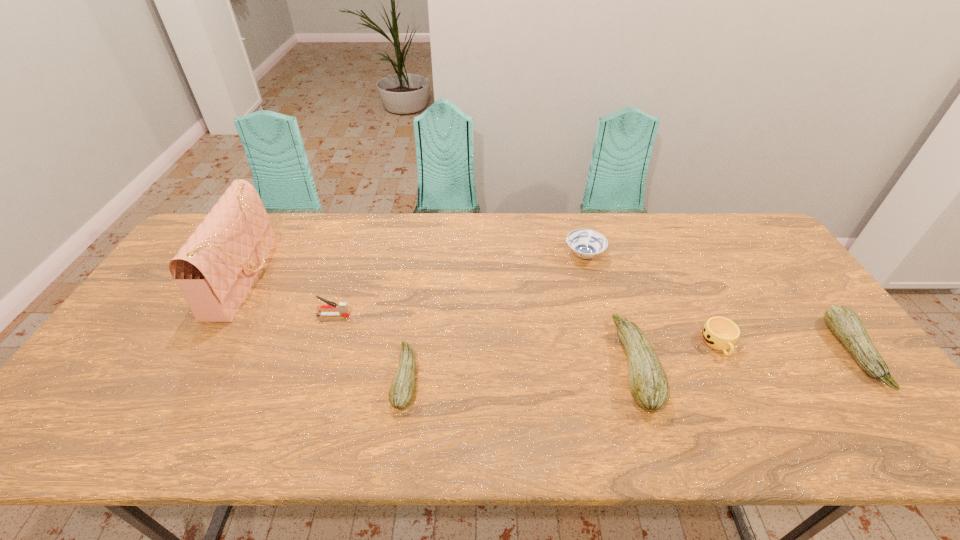
Please point a free position for a zucchini on the left. Please provide its 2D coordinates. Your answer should be formatted as a tuple, i.e. [(x, y)], where the tuple contains the x and y coordinates of a point satisfying the conditions above.

[(165, 391)]